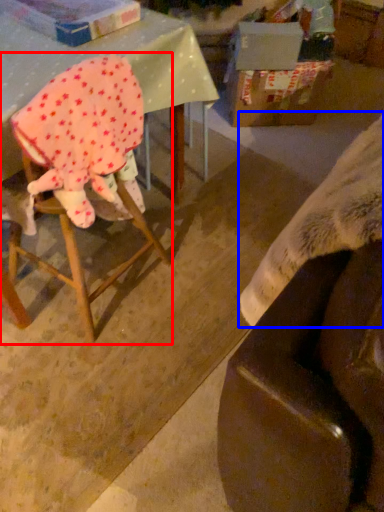
Question: Which point is closer to the camera, chair (highlighted by a red box) or blanket (highlighted by a blue box)?

Choices:
 (A) chair
 (B) blanket

Answer: (B)